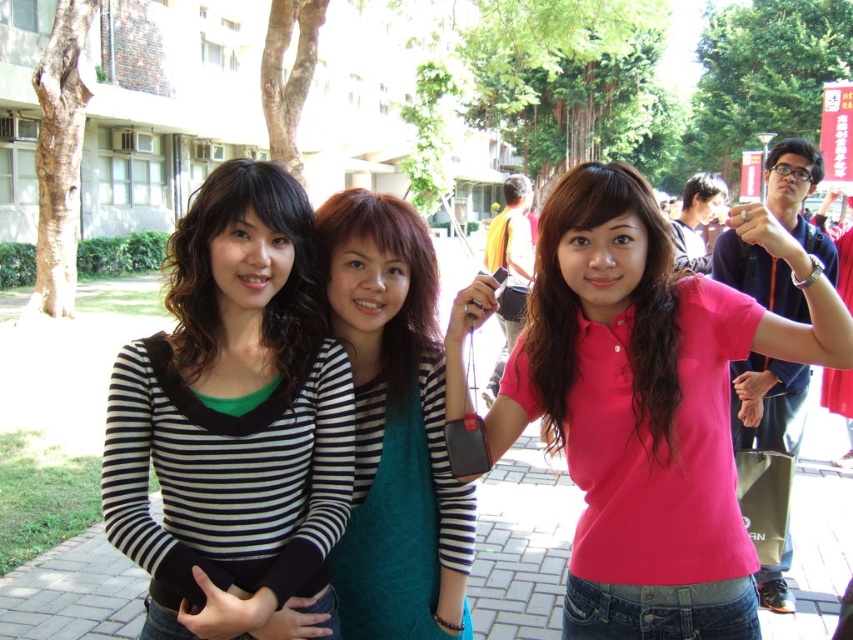
You are standing at the origin of the coordinate system in the image. You want to walk to point (718,452). However, there is an obstacle at point (320,540). Can you reach your destination without passing through the obstacle?

Point (718,452) is behind point (320,540), so you can reach it without passing through the obstacle.

You are a photographer trying to capture a clear shot of the black and white striped shirt at center and the striped fabric shirt at center. Which one is blocking the view of the other?

The black and white striped shirt at center is blocking the view of the striped fabric shirt at center because it is positioned in front of it.

You are standing at the point marked by the coordinates (231, 417) in the image. Which object from the scene are you closest to?

The point at coordinates (231, 417) indicates the black and white striped shirt at center, so you are closest to the black and white striped shirt at center.